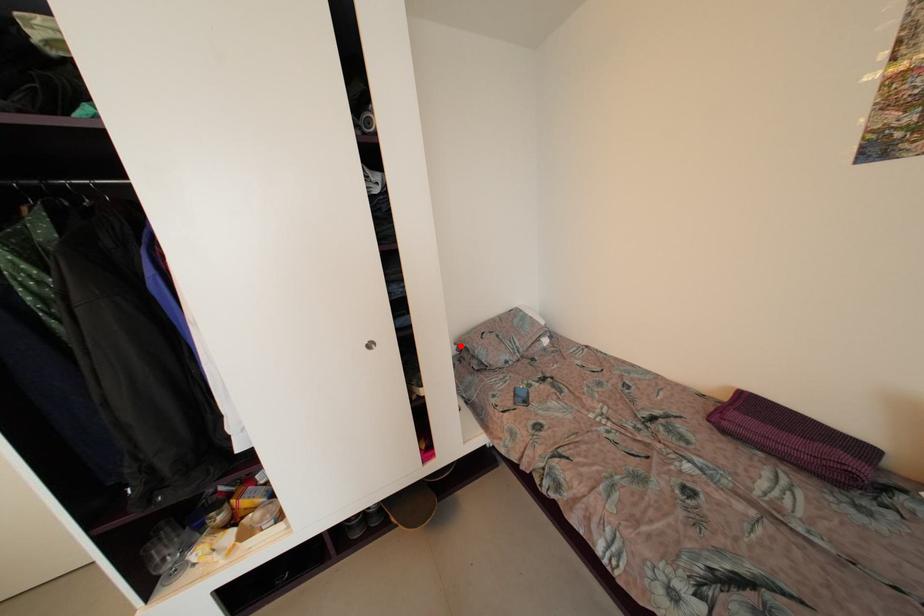
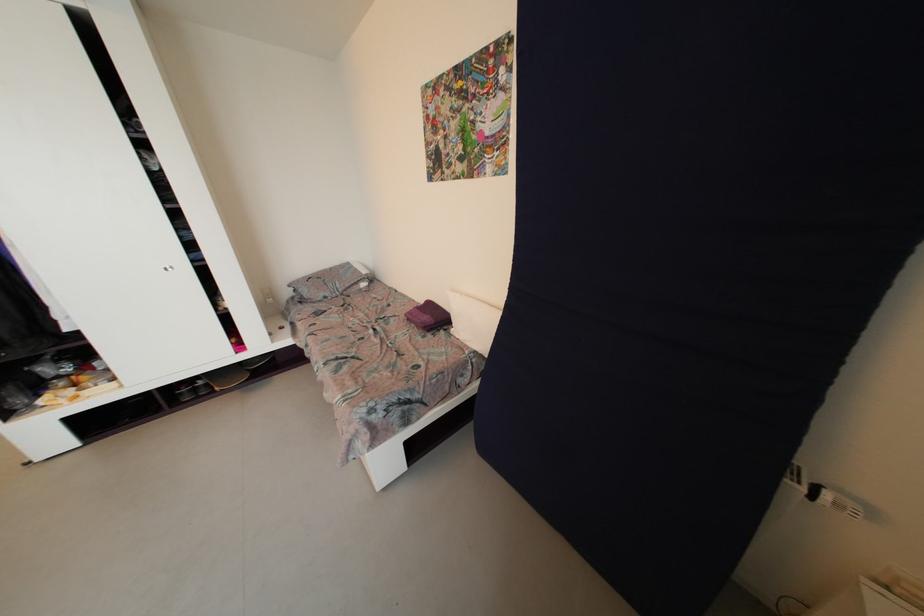
Question: I am providing you with two images of the same scene from different viewpoints. Image1 has a red point marked. In image2, the corresponding 3D location appears at what relative position? Reply with the corresponding letter.

Choices:
 (A) Closer
 (B) Farther

Answer: (A)